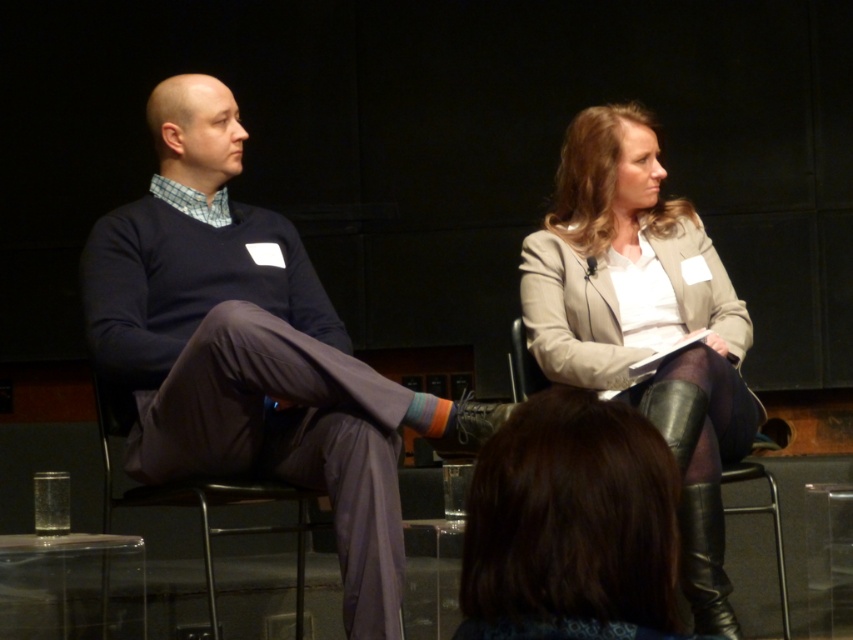
In the scene shown: Can you confirm if dark blue sweater at left is positioned above beige leather jacket at upper right?

Correct, dark blue sweater at left is located above beige leather jacket at upper right.

Based on the photo, does dark blue sweater at left appear on the left side of beige leather jacket at upper right?

Yes, dark blue sweater at left is to the left of beige leather jacket at upper right.

Find the location of a particular element. This screenshot has height=640, width=853. dark blue sweater at left is located at coordinates (247, 349).

Find the location of a particular element. dark blue sweater at left is located at coordinates (247, 349).

In the scene shown: Does dark blue sweater at left have a greater width compared to metallic gray chair at center?

Yes, dark blue sweater at left is wider than metallic gray chair at center.

Does dark blue sweater at left appear over metallic gray chair at center?

Yes, dark blue sweater at left is above metallic gray chair at center.

Measure the distance between dark blue sweater at left and camera.

dark blue sweater at left is 2.12 meters from camera.

Where is `dark blue sweater at left`? This screenshot has width=853, height=640. dark blue sweater at left is located at coordinates (247, 349).

Does dark blue sweater at left appear on the left side of leather boots at lower right?

Correct, you'll find dark blue sweater at left to the left of leather boots at lower right.

Is the position of dark blue sweater at left more distant than that of leather boots at lower right?

Yes, dark blue sweater at left is behind leather boots at lower right.

Is point (360, 502) more distant than point (544, 544)?

Yes, point (360, 502) is behind point (544, 544).

Identify the location of dark blue sweater at left. Image resolution: width=853 pixels, height=640 pixels. (247, 349).